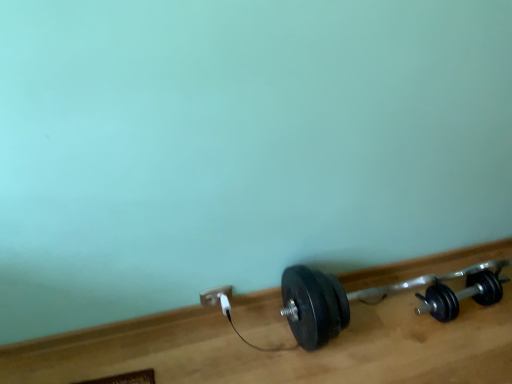
Question: Looking at their shapes, would you say white plastic power plug at lower center is wider or thinner than black rubber dumbbell at lower right, which is counted as the 2th dumbbell, starting from the right?

Choices:
 (A) wide
 (B) thin

Answer: (B)

Question: From a real-world perspective, is white plastic power plug at lower center above or below black rubber dumbbell at lower right, which is counted as the 2th dumbbell, starting from the right?

Choices:
 (A) above
 (B) below

Answer: (B)

Question: Considering the real-world distances, which object is farthest from the black rubber dumbbell at lower right, the 2th dumbbell positioned from the left?

Choices:
 (A) black rubber dumbbell at lower right, which appears as the 1th dumbbell when viewed from the left
 (B) white plastic power plug at lower center
 (C) white plastic plug at lower center

Answer: (C)

Question: Which object is positioned farthest from the black rubber dumbbell at lower right, which appears as the 1th dumbbell when viewed from the left?

Choices:
 (A) white plastic plug at lower center
 (B) black rubber dumbbell at lower right, the first dumbbell viewed from the right
 (C) white plastic power plug at lower center

Answer: (A)